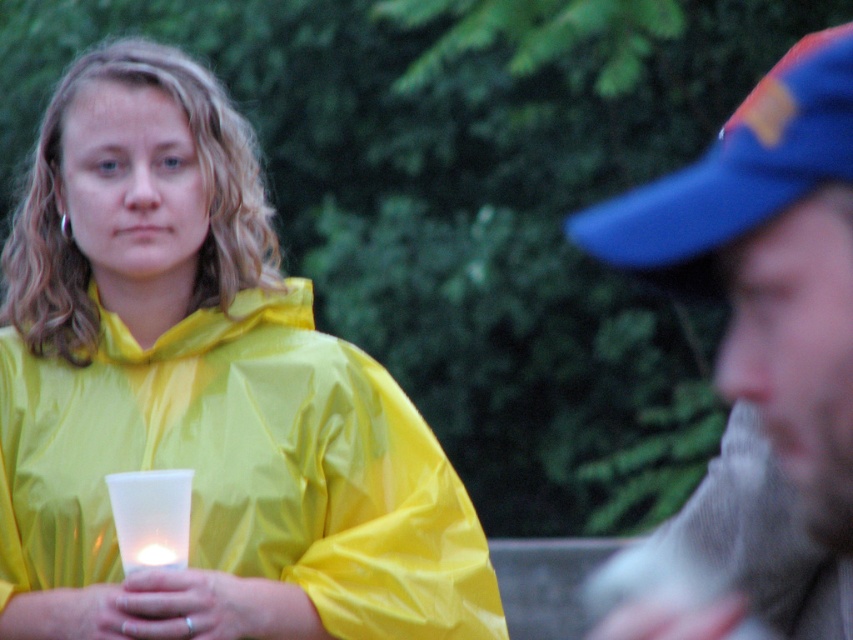
Question: Which of the following is the farthest from the observer?

Choices:
 (A) blue fabric baseball cap at upper right
 (B) translucent plastic candle at lower left

Answer: (B)

Question: Can you confirm if yellow matte raincoat at center is wider than translucent plastic candle at lower left?

Choices:
 (A) no
 (B) yes

Answer: (B)

Question: From the image, what is the correct spatial relationship of yellow matte raincoat at center in relation to translucent plastic candle at lower left?

Choices:
 (A) right
 (B) left

Answer: (A)

Question: Based on their relative distances, which object is farther from the translucent plastic candle at lower left?

Choices:
 (A) blue fabric cap at upper right
 (B) yellow matte raincoat at center
 (C) blue fabric baseball cap at upper right

Answer: (A)

Question: Can you confirm if blue fabric cap at upper right is positioned above translucent plastic candle at lower left?

Choices:
 (A) no
 (B) yes

Answer: (B)

Question: Which of the following is the farthest from the observer?

Choices:
 (A) (372, 397)
 (B) (144, 508)
 (C) (759, 312)
 (D) (801, 136)

Answer: (A)